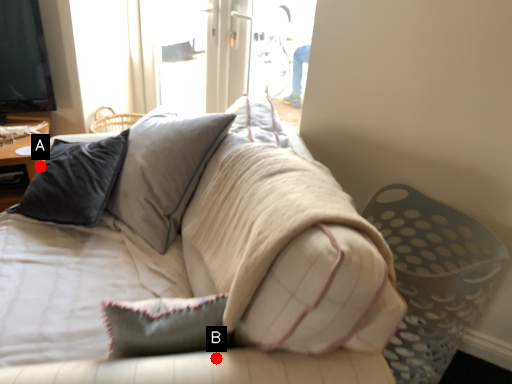
Question: Two points are circled on the image, labeled by A and B beside each circle. Which point appears farthest from the camera in this image?

Choices:
 (A) A is further
 (B) B is further

Answer: (A)